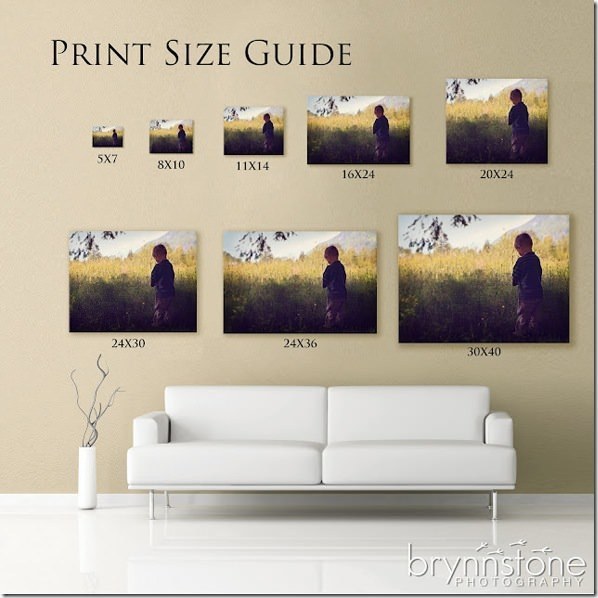
You are a GUI agent. You are given a task and a screenshot of the screen. Output one action in this format:
    pyautogui.click(x=<x>, y=<y>)
    Task: Click on the cusion
    
    Given the screenshot: What is the action you would take?
    pyautogui.click(x=259, y=457)